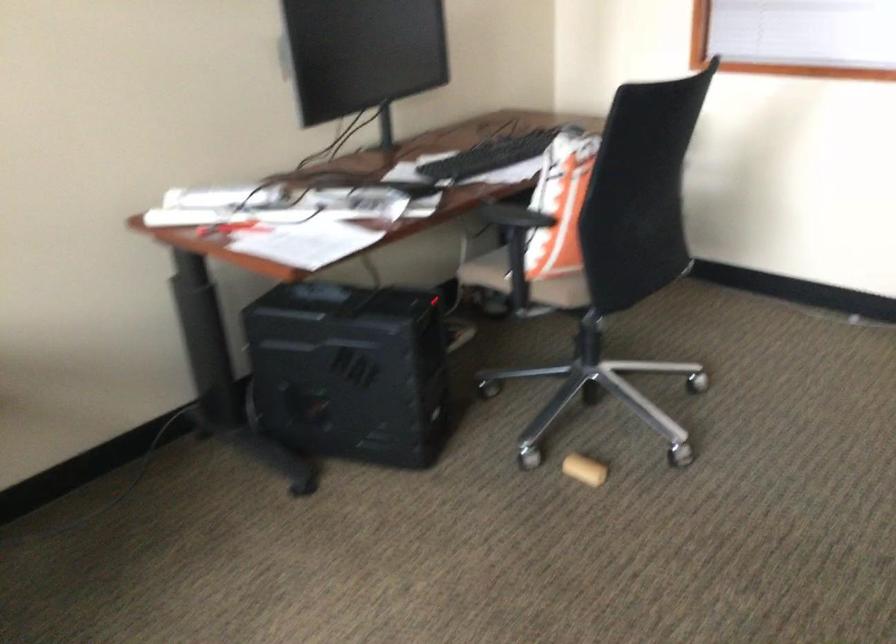
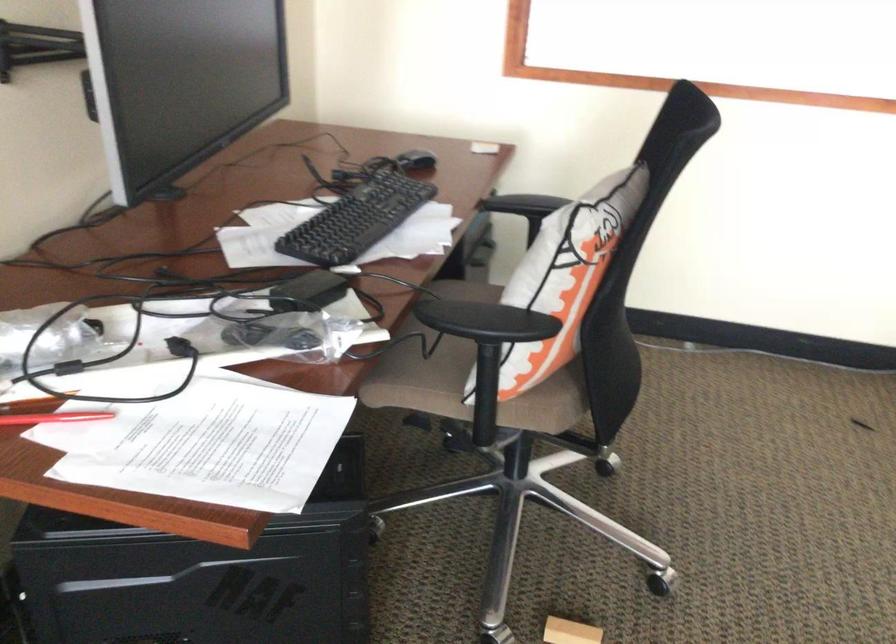
Locate, in the second image, the point that corresponds to (583,464) in the first image.

(570, 632)